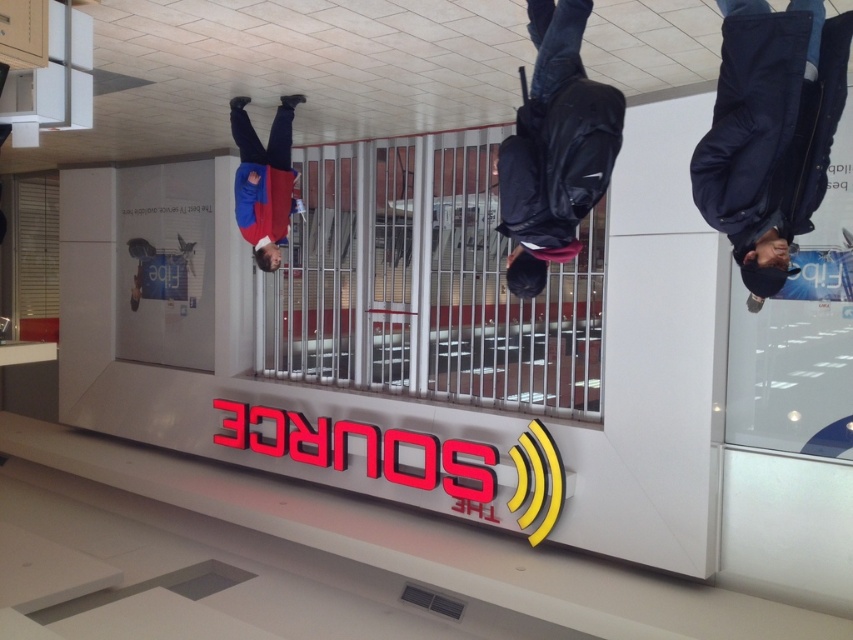
You are an interior designer observing the surreal scene. You notice the dark blue jacket at center and the blue fabric jacket at upper center. Which jacket appears shorter in the scene?

The dark blue jacket at center is not as tall as the blue fabric jacket at upper center, so the dark blue jacket at center appears shorter.

You are trying to locate the dark blue backpack at center and the blue fabric jacket at upper center in the image. Which object is positioned more to the right side?

The dark blue backpack at center is positioned to the right of the blue fabric jacket at upper center, so the dark blue backpack at center is more to the right side.